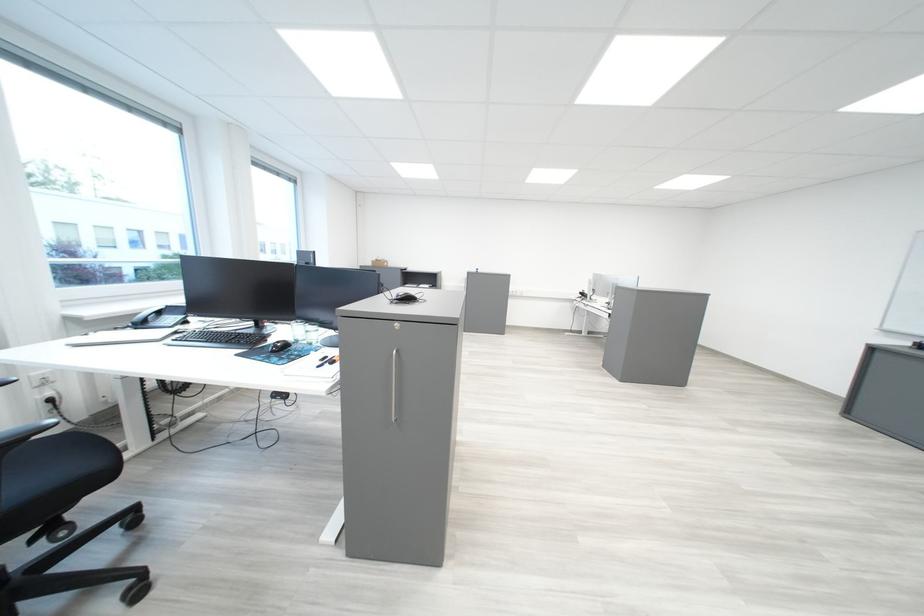
Where would you lift the telephone handset? Please return your answer as a coordinate pair (x, y).

(146, 314)